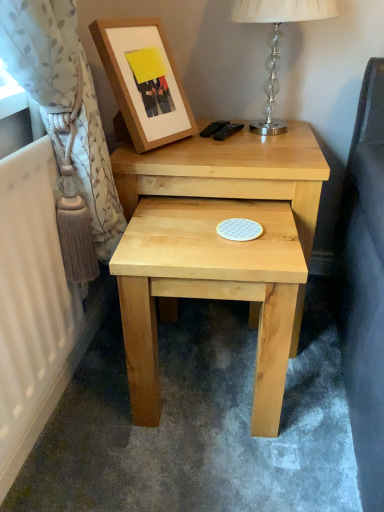
Question: Should I look upward or downward to see light beige floral fabric curtain at left?

Choices:
 (A) down
 (B) up

Answer: (B)

Question: Is clear glass lamp at upper right positioned beyond the bounds of natural wood nightstand at center?

Choices:
 (A) yes
 (B) no

Answer: (A)

Question: Could natural wood nightstand at center be considered to be inside clear glass lamp at upper right?

Choices:
 (A) yes
 (B) no

Answer: (B)

Question: Does clear glass lamp at upper right have a smaller size compared to natural wood nightstand at center?

Choices:
 (A) no
 (B) yes

Answer: (B)

Question: From a real-world perspective, is clear glass lamp at upper right under natural wood nightstand at center?

Choices:
 (A) no
 (B) yes

Answer: (A)

Question: Can you confirm if clear glass lamp at upper right is bigger than natural wood nightstand at center?

Choices:
 (A) yes
 (B) no

Answer: (B)

Question: Is clear glass lamp at upper right aimed at natural wood nightstand at center?

Choices:
 (A) yes
 (B) no

Answer: (B)

Question: Considering the relative sizes of light beige floral fabric curtain at left and natural wood stool at center in the image provided, is light beige floral fabric curtain at left thinner than natural wood stool at center?

Choices:
 (A) no
 (B) yes

Answer: (B)

Question: Does light beige floral fabric curtain at left appear on the right side of natural wood stool at center?

Choices:
 (A) no
 (B) yes

Answer: (A)

Question: Can you confirm if light beige floral fabric curtain at left is bigger than natural wood stool at center?

Choices:
 (A) no
 (B) yes

Answer: (B)

Question: Is light beige floral fabric curtain at left not close to natural wood stool at center?

Choices:
 (A) no
 (B) yes

Answer: (A)

Question: Is light beige floral fabric curtain at left aimed at natural wood stool at center?

Choices:
 (A) no
 (B) yes

Answer: (A)

Question: Can you confirm if light beige floral fabric curtain at left is taller than natural wood stool at center?

Choices:
 (A) yes
 (B) no

Answer: (A)

Question: Can you confirm if natural wood stool at center is smaller than natural wood nightstand at center?

Choices:
 (A) no
 (B) yes

Answer: (B)